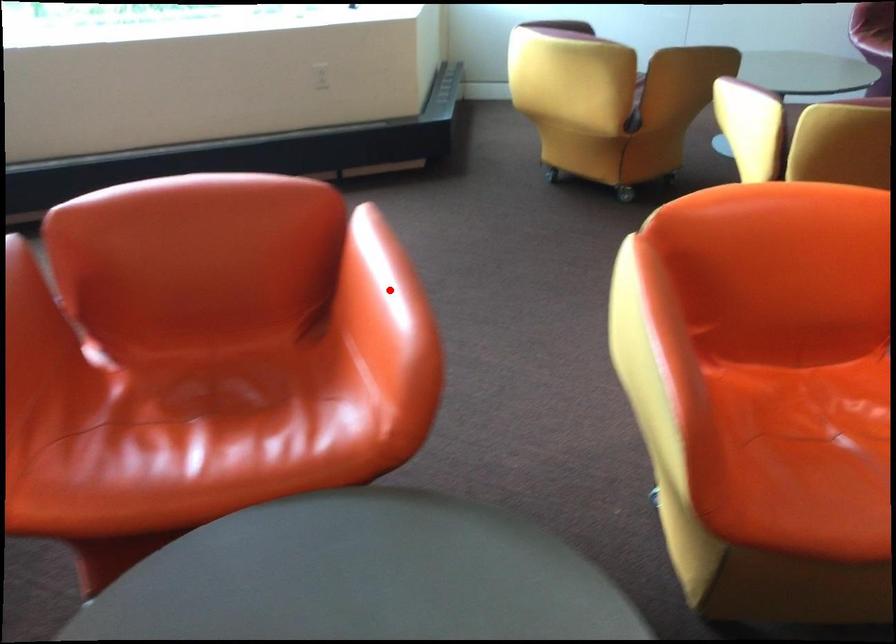
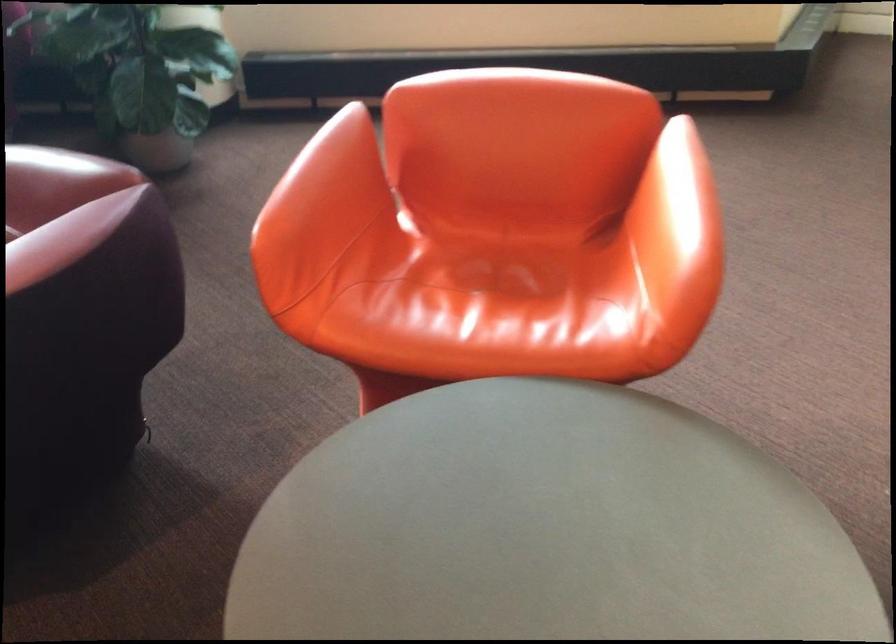
Locate, in the second image, the point that corresponds to the highlighted location in the first image.

(687, 199)